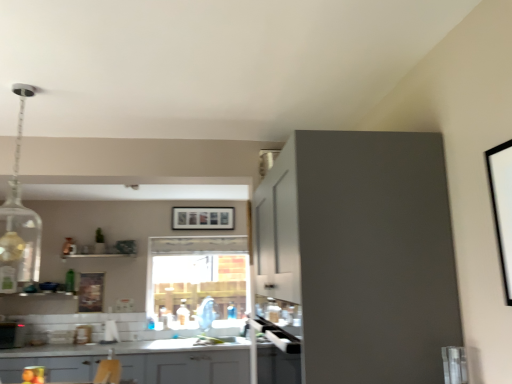
Question: Is white glossy sink at center in front of or behind matte gray cabinets at lower center, the second cabinetry positioned from the front, in the image?

Choices:
 (A) front
 (B) behind

Answer: (B)

Question: Considering the positions of white glossy sink at center and matte gray cabinets at lower center, which is the 1th cabinetry in bottom-to-top order, in the image, is white glossy sink at center taller or shorter than matte gray cabinets at lower center, which is the 1th cabinetry in bottom-to-top order,?

Choices:
 (A) tall
 (B) short

Answer: (B)

Question: Which of these objects is positioned farthest from the white glossy sink at center?

Choices:
 (A) white matte picture frame at upper right, which ranks as the third picture frame in left-to-right order
 (B) matte black picture frame at center, which ranks as the second picture frame in top-to-bottom order
 (C) green glass bottle at lower left
 (D) wooden picture frame at lower left, the first picture frame from the left
 (E) matte gray cabinet at upper right, acting as the second cabinetry starting from the back

Answer: (A)

Question: Which is farther from the matte gray cabinets at lower center, which ranks as the 2th cabinetry in top-to-bottom order?

Choices:
 (A) metallic silver toaster at lower left
 (B) matte black picture frame at center, positioned as the second picture frame in right-to-left order
 (C) white glossy sink at center
 (D) green glass bottle at lower left
 (E) matte gray cabinet at upper right, which is the 1th cabinetry from front to back

Answer: (E)